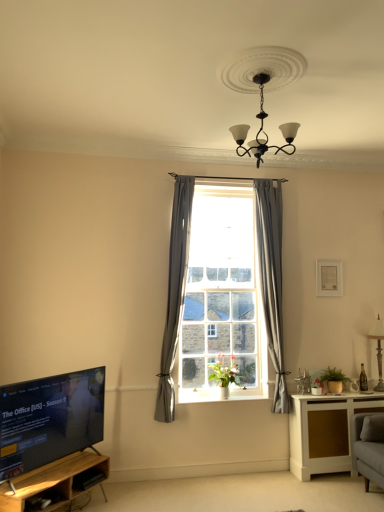
Question: In terms of width, does black glossy tv at lower left look wider or thinner when compared to white matte picture frame at upper right?

Choices:
 (A) thin
 (B) wide

Answer: (B)

Question: Does point (86, 409) appear closer or farther from the camera than point (342, 282)?

Choices:
 (A) closer
 (B) farther

Answer: (A)

Question: Based on their relative distances, which object is farther from the gray fabric curtain at center, positioned as the 2th curtain in right-to-left order?

Choices:
 (A) clear glass window at center
 (B) black wrought iron chandelier at upper center
 (C) wooden at left
 (D) white wood cabinet at lower right
 (E) clear glass window sill at center

Answer: (D)

Question: Based on their relative distances, which object is nearer to the black wrought iron chandelier at upper center?

Choices:
 (A) green matte plant at right, placed as the 2th plant when sorted from left to right
 (B) clear glass window sill at center
 (C) wooden at left
 (D) clear glass window at center
 (E) white wood cabinet at lower right

Answer: (D)